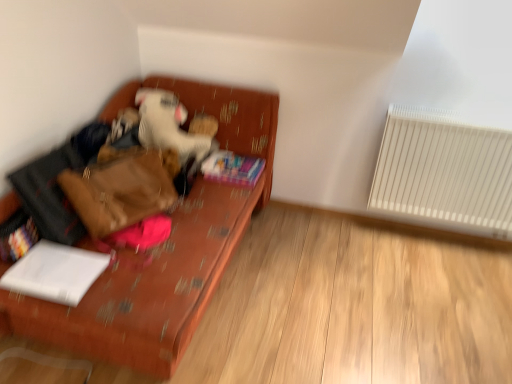
Where is `vacant area on top of white paper at lower left, marked as the 1th book in a bottom-to-top arrangement (from a real-world perspective)`? vacant area on top of white paper at lower left, marked as the 1th book in a bottom-to-top arrangement (from a real-world perspective) is located at coordinates (60, 264).